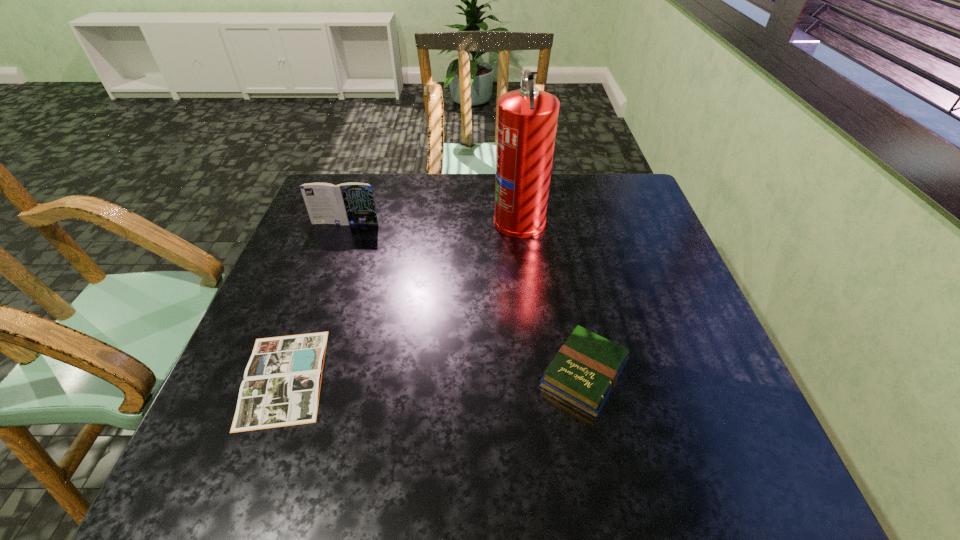
Where is `fire extinguisher`? The height and width of the screenshot is (540, 960). fire extinguisher is located at coordinates (527, 118).

Where is `the tallest book`? the tallest book is located at coordinates (348, 203).

Find the location of `the farthest book`. the farthest book is located at coordinates (348, 203).

Locate an element on the screen. the third tallest object is located at coordinates (584, 372).

Image resolution: width=960 pixels, height=540 pixels. In order to click on the rightmost book in this screenshot , I will do `click(584, 372)`.

You are a GUI agent. You are given a task and a screenshot of the screen. Output one action in this format:
    pyautogui.click(x=<x>, y=<y>)
    Task: Click on the shortest object
    This screenshot has height=540, width=960.
    Given the screenshot: What is the action you would take?
    pyautogui.click(x=281, y=387)

The image size is (960, 540). Find the location of `free space located 0.130m on the instruction side of the fire extinguisher`. free space located 0.130m on the instruction side of the fire extinguisher is located at coordinates (449, 220).

Where is `vacant region located on the instruction side of the fire extinguisher`? This screenshot has height=540, width=960. vacant region located on the instruction side of the fire extinguisher is located at coordinates (357, 220).

Find the location of `free space located on the instruction side of the fire extinguisher`. free space located on the instruction side of the fire extinguisher is located at coordinates (425, 220).

Locate an element on the screen. free space located on the front cover of the second tallest object is located at coordinates (314, 310).